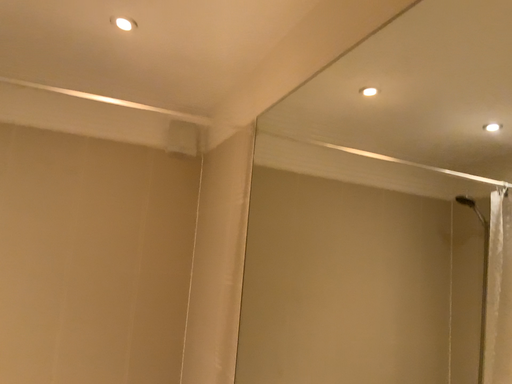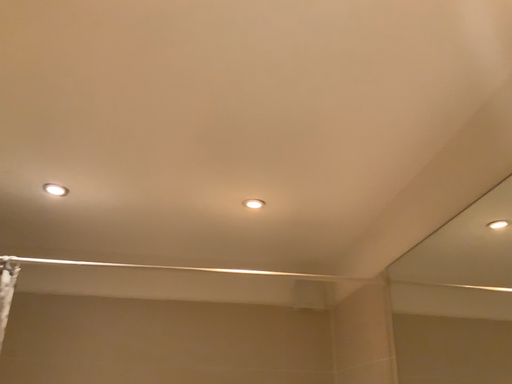
Question: How did the camera likely rotate when shooting the video?

Choices:
 (A) rotated left
 (B) rotated right

Answer: (A)